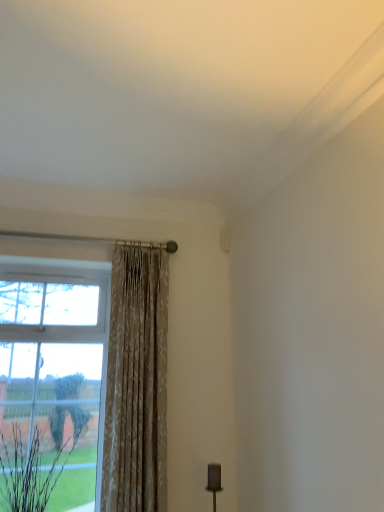
Question: Can you confirm if brown textured plant at lower left is bigger than floral fabric curtain at left?

Choices:
 (A) yes
 (B) no

Answer: (B)

Question: Does brown textured plant at lower left have a greater width compared to floral fabric curtain at left?

Choices:
 (A) no
 (B) yes

Answer: (B)

Question: Can you confirm if brown textured plant at lower left is positioned to the right of floral fabric curtain at left?

Choices:
 (A) yes
 (B) no

Answer: (B)

Question: Is brown textured plant at lower left not close to floral fabric curtain at left?

Choices:
 (A) no
 (B) yes

Answer: (A)

Question: Can you confirm if brown textured plant at lower left is shorter than floral fabric curtain at left?

Choices:
 (A) no
 (B) yes

Answer: (B)

Question: Is brown textured plant at lower left directly adjacent to floral fabric curtain at left?

Choices:
 (A) no
 (B) yes

Answer: (A)

Question: From a real-world perspective, is floral fabric curtain at left located higher than brown textured plant at lower left?

Choices:
 (A) no
 (B) yes

Answer: (B)

Question: Does floral fabric curtain at left have a smaller size compared to brown textured plant at lower left?

Choices:
 (A) yes
 (B) no

Answer: (B)

Question: Are floral fabric curtain at left and brown textured plant at lower left beside each other?

Choices:
 (A) yes
 (B) no

Answer: (B)

Question: Is floral fabric curtain at left bigger than brown textured plant at lower left?

Choices:
 (A) no
 (B) yes

Answer: (B)

Question: Is floral fabric curtain at left facing towards brown textured plant at lower left?

Choices:
 (A) yes
 (B) no

Answer: (B)

Question: Is floral fabric curtain at left turned away from brown textured plant at lower left?

Choices:
 (A) no
 (B) yes

Answer: (A)

Question: Visually, is floral fabric curtain at left positioned to the left or to the right of brown textured plant at lower left?

Choices:
 (A) right
 (B) left

Answer: (A)